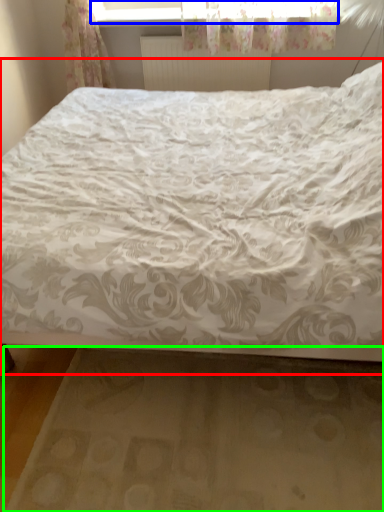
Question: Which object is positioned farthest from bed (highlighted by a red box)? Select from window frame (highlighted by a blue box) and bed frame (highlighted by a green box).

Choices:
 (A) window frame
 (B) bed frame

Answer: (A)